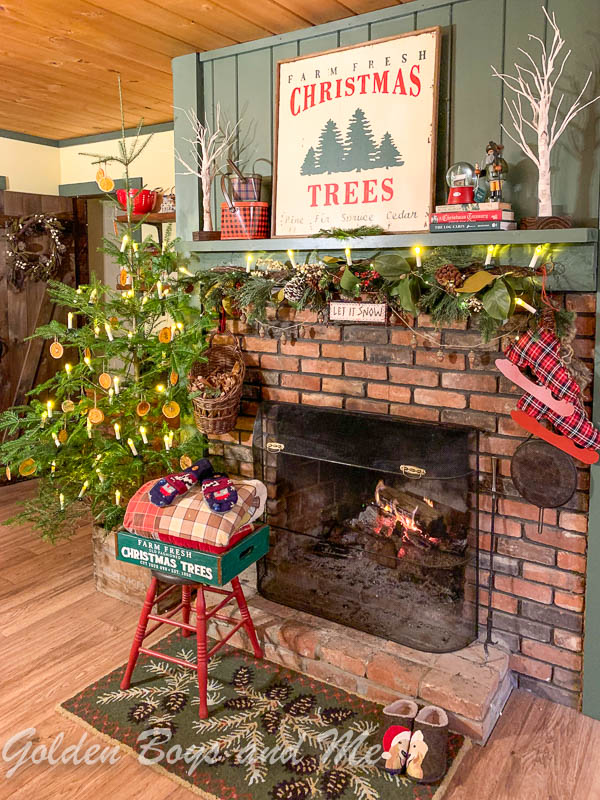
The image size is (600, 800). Find the location of `christmas tree`. christmas tree is located at coordinates tap(235, 332), tap(164, 434), tap(144, 278).